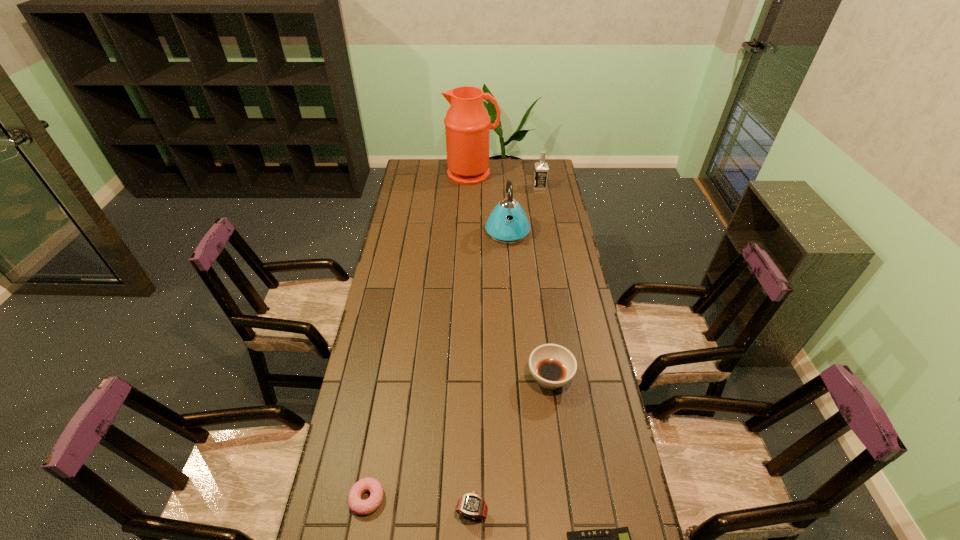
In order to click on soup bowl present at the right edge in this screenshot , I will do `click(553, 366)`.

Identify the location of vacant space at the far edge. This screenshot has height=540, width=960. (496, 169).

The image size is (960, 540). I want to click on free region at the left edge of the desktop, so click(398, 206).

The image size is (960, 540). Find the location of `free point at the right edge`. free point at the right edge is located at coordinates (541, 234).

The image size is (960, 540). Find the location of `vacant space at the far left corner`. vacant space at the far left corner is located at coordinates (433, 175).

I want to click on free area in between the water jug and the watch, so click(x=472, y=343).

At what (x,y) coordinates should I click in order to perform the action: click on vacant space that is in between the watch and the second shortest object. Please return your answer as a coordinate pair (x, y). Image resolution: width=960 pixels, height=540 pixels. Looking at the image, I should click on (420, 505).

Where is `free area in between the fifth tallest object and the fourth shortest object`? This screenshot has height=540, width=960. free area in between the fifth tallest object and the fourth shortest object is located at coordinates (511, 446).

What are the coordinates of `free space between the watch and the leftmost object` in the screenshot? It's located at (420, 505).

Locate an element on the screen. This screenshot has width=960, height=540. unoccupied area between the vodka and the leftmost object is located at coordinates coord(453,343).